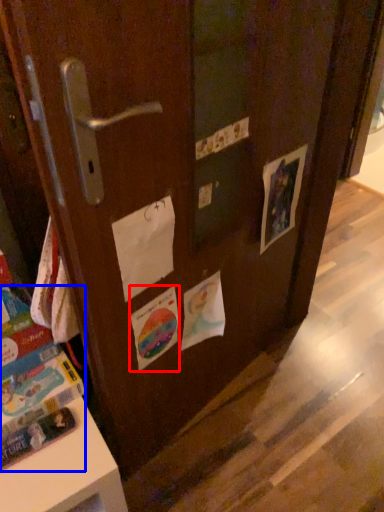
Question: Which of the following is the closest to the observer, flyer (highlighted by a red box) or book (highlighted by a blue box)?

Choices:
 (A) flyer
 (B) book

Answer: (B)